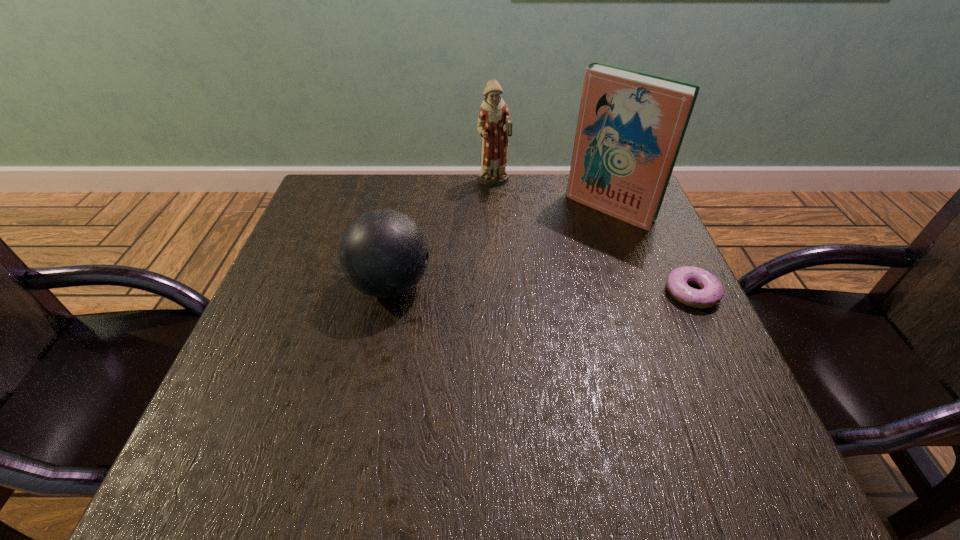
Locate an element on the screen. The image size is (960, 540). the leftmost object is located at coordinates (383, 253).

The height and width of the screenshot is (540, 960). Identify the location of bowling ball. (383, 253).

Locate an element on the screen. the shortest object is located at coordinates pos(711,292).

Identify the location of hardback book. The width and height of the screenshot is (960, 540). (631, 125).

Identify the location of the second object from left to right. The width and height of the screenshot is (960, 540). (494, 125).

The width and height of the screenshot is (960, 540). I want to click on the second tallest object, so click(494, 125).

This screenshot has width=960, height=540. Identify the location of blank space located 0.070m on the grip area of the third tallest object. (465, 285).

Find the location of `vacant area situated on the front of the doughnut`. vacant area situated on the front of the doughnut is located at coordinates (754, 421).

This screenshot has width=960, height=540. What are the coordinates of `blank space located 0.230m on the cover of the tallest object` in the screenshot? It's located at (540, 275).

The image size is (960, 540). Identify the location of free location located on the cover of the tallest object. (572, 244).